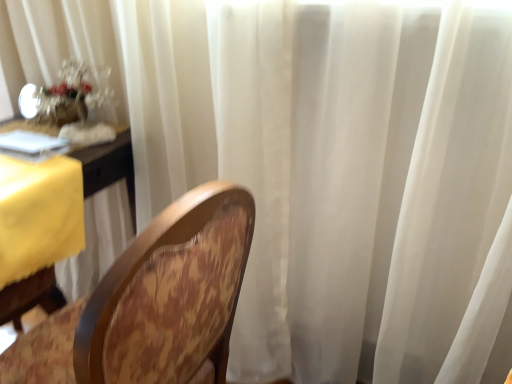
The image size is (512, 384). What do you see at coordinates (152, 303) in the screenshot? I see `wooden chair at center` at bounding box center [152, 303].

Locate an element on the screen. yellow fabric table at left is located at coordinates (109, 167).

Can we say yellow fabric table at left lies outside translucent glass floral arrangement at upper left?

Absolutely, yellow fabric table at left is external to translucent glass floral arrangement at upper left.

Identify the location of floral arrangement to the right of yellow fabric table at left. This screenshot has width=512, height=384. (73, 93).

Between yellow fabric table at left and translucent glass floral arrangement at upper left, which one has more height?

Standing taller between the two is yellow fabric table at left.

Could you tell me if translucent glass floral arrangement at upper left is facing yellow fabric table at left?

No, translucent glass floral arrangement at upper left is not turned towards yellow fabric table at left.

Would you say yellow fabric table at left is part of translucent glass floral arrangement at upper left's contents?

Definitely not — yellow fabric table at left is not inside translucent glass floral arrangement at upper left.

This screenshot has height=384, width=512. Find the location of `floral arrangement above the yellow fabric table at left (from the image's perspective)`. floral arrangement above the yellow fabric table at left (from the image's perspective) is located at coordinates (73, 93).

Looking at this image, considering the relative sizes of translucent glass floral arrangement at upper left and yellow fabric table at left in the image provided, is translucent glass floral arrangement at upper left thinner than yellow fabric table at left?

Yes.

Which object is closer to the camera, translucent glass floral arrangement at upper left or wooden chair at center?

Positioned in front is wooden chair at center.

From the picture: Between translucent glass floral arrangement at upper left and wooden chair at center, which one appears on the left side from the viewer's perspective?

Positioned to the left is translucent glass floral arrangement at upper left.

Are translucent glass floral arrangement at upper left and wooden chair at center located far from each other?

translucent glass floral arrangement at upper left is near wooden chair at center, not far away.

Is translucent glass floral arrangement at upper left positioned with its back to wooden chair at center?

No, translucent glass floral arrangement at upper left is not facing away from wooden chair at center.

Looking at the image, does wooden chair at center seem bigger or smaller compared to translucent glass floral arrangement at upper left?

Considering their sizes, wooden chair at center takes up more space than translucent glass floral arrangement at upper left.

From the image's perspective, is wooden chair at center below translucent glass floral arrangement at upper left?

Indeed, from the image's perspective, wooden chair at center is shown beneath translucent glass floral arrangement at upper left.

Is wooden chair at center looking in the opposite direction of translucent glass floral arrangement at upper left?

No, wooden chair at center's orientation is not away from translucent glass floral arrangement at upper left.

Considering the relative sizes of wooden chair at center and translucent glass floral arrangement at upper left in the image provided, is wooden chair at center thinner than translucent glass floral arrangement at upper left?

In fact, wooden chair at center might be wider than translucent glass floral arrangement at upper left.

Does yellow fabric table at left turn towards wooden chair at center?

No.

How different are the orientations of yellow fabric table at left and wooden chair at center in degrees?

yellow fabric table at left and wooden chair at center are facing 83.8 degrees away from each other.

Is wooden chair at center completely or partially inside yellow fabric table at left?

Definitely not — wooden chair at center is not inside yellow fabric table at left.

Between yellow fabric table at left and wooden chair at center, which one has smaller size?

Smaller between the two is yellow fabric table at left.

Which object is closer to the camera taking this photo, wooden chair at center or yellow fabric table at left?

Positioned in front is wooden chair at center.

Is wooden chair at center wider or thinner than yellow fabric table at left?

wooden chair at center is wider than yellow fabric table at left.

Which of these two, wooden chair at center or yellow fabric table at left, is bigger?

wooden chair at center.

Is yellow fabric table at left inside wooden chair at center?

Definitely not — yellow fabric table at left is not inside wooden chair at center.

Image resolution: width=512 pixels, height=384 pixels. I want to click on floral arrangement on the right of yellow fabric table at left, so click(73, 93).

The image size is (512, 384). Identify the location of floral arrangement that is above the yellow fabric table at left (from the image's perspective). (73, 93).

When comparing their distances from wooden chair at center, does translucent glass floral arrangement at upper left or yellow fabric table at left seem closer?

yellow fabric table at left lies closer to wooden chair at center than the other object.

When comparing their distances from wooden chair at center, does yellow fabric table at left or translucent glass floral arrangement at upper left seem further?

Among the two, translucent glass floral arrangement at upper left is located further to wooden chair at center.

When comparing their distances from yellow fabric table at left, does wooden chair at center or translucent glass floral arrangement at upper left seem further?

wooden chair at center.

Considering their positions, is yellow fabric table at left positioned closer to translucent glass floral arrangement at upper left than wooden chair at center?

The object closer to translucent glass floral arrangement at upper left is yellow fabric table at left.

Which object lies nearer to the anchor point yellow fabric table at left, translucent glass floral arrangement at upper left or wooden chair at center?

translucent glass floral arrangement at upper left.

Which object lies further to the anchor point translucent glass floral arrangement at upper left, wooden chair at center or yellow fabric table at left?

wooden chair at center.

Image resolution: width=512 pixels, height=384 pixels. In order to click on table located between wooden chair at center and translucent glass floral arrangement at upper left in the depth direction in this screenshot , I will do `click(109, 167)`.